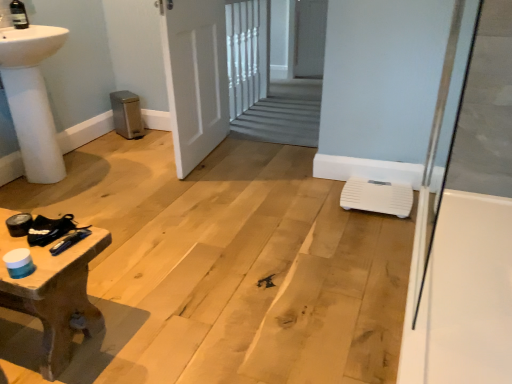
At what (x,y) coordinates should I click in order to perform the action: click on vacant space that is in between white plastic scale at lower right and wooden textured table at lower left. Please return your answer as a coordinate pair (x, y). This screenshot has height=384, width=512. Looking at the image, I should click on (238, 250).